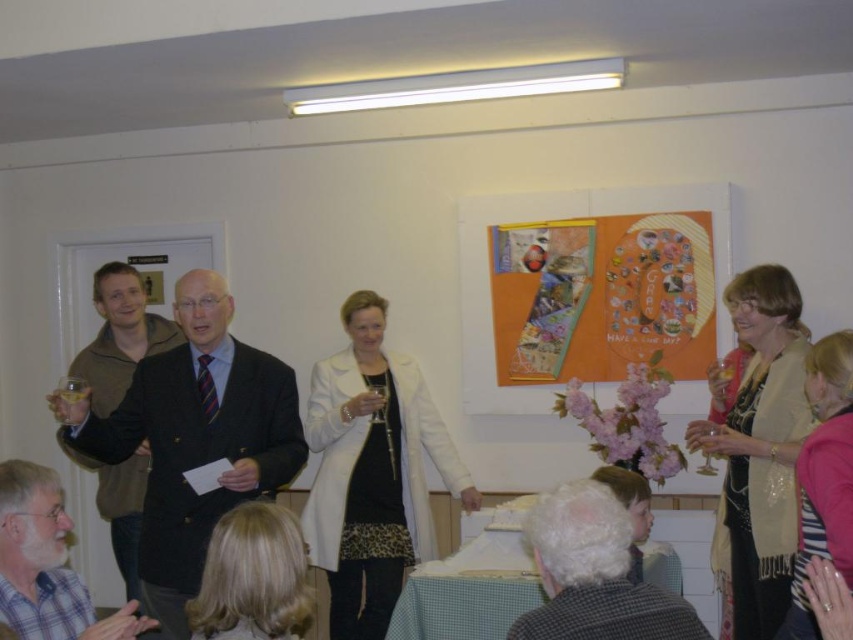
You are a photographer at a social gathering. You want to take a photo of the dark suit at center and the white woolen coat at center together in the frame. The camera has a minimum distance requirement of 80 centimeters between subjects to focus properly. Can you capture both subjects clearly in the same photo?

The dark suit at center and white woolen coat at center are 86.90 centimeters apart from each other. Since the required minimum distance is 80 centimeters, the photographer can capture both subjects clearly in the same photo as they are sufficiently spaced apart.

You are organizing a photo shoot and need to know the relative sizes of the beige textured scarf at right and the pink knitwear at lower right to ensure they fit within the frame. Which object is wider?

The beige textured scarf at right is wider than the pink knitwear at lower right.